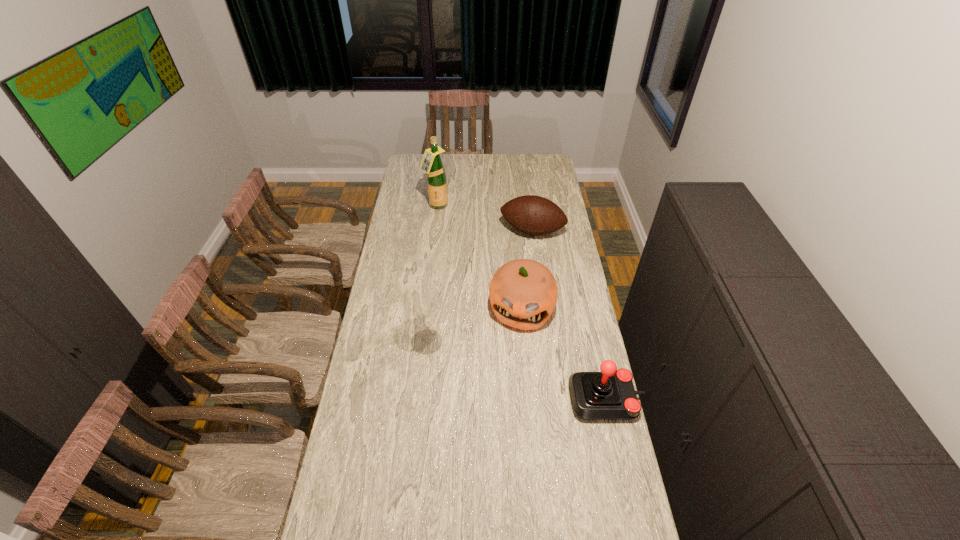
What are the coordinates of `free region located 0.400m on the laces of the football` in the screenshot? It's located at (506, 302).

Identify the location of vacant space located 0.050m on the laces of the football. The image size is (960, 540). (523, 250).

Find the location of `vacant space located 0.120m on the laces of the football`. vacant space located 0.120m on the laces of the football is located at coordinates (519, 260).

This screenshot has width=960, height=540. Identify the location of vacant space situated 0.330m on the face of the pumpkin. (502, 408).

Where is `vacant area situated on the face of the pumpkin`? The width and height of the screenshot is (960, 540). vacant area situated on the face of the pumpkin is located at coordinates (512, 359).

At what (x,y) coordinates should I click in order to perform the action: click on blank space located on the face of the pumpkin. Please return your answer as a coordinate pair (x, y). This screenshot has height=540, width=960. Looking at the image, I should click on (505, 393).

Find the location of a particular element. object present at the left edge is located at coordinates (431, 163).

The width and height of the screenshot is (960, 540). In order to click on joystick located in the right edge section of the desktop in this screenshot , I will do `click(610, 394)`.

Where is `football located at the right edge`? football located at the right edge is located at coordinates (535, 215).

Locate an element on the screen. This screenshot has height=540, width=960. pumpkin that is at the right edge is located at coordinates (523, 293).